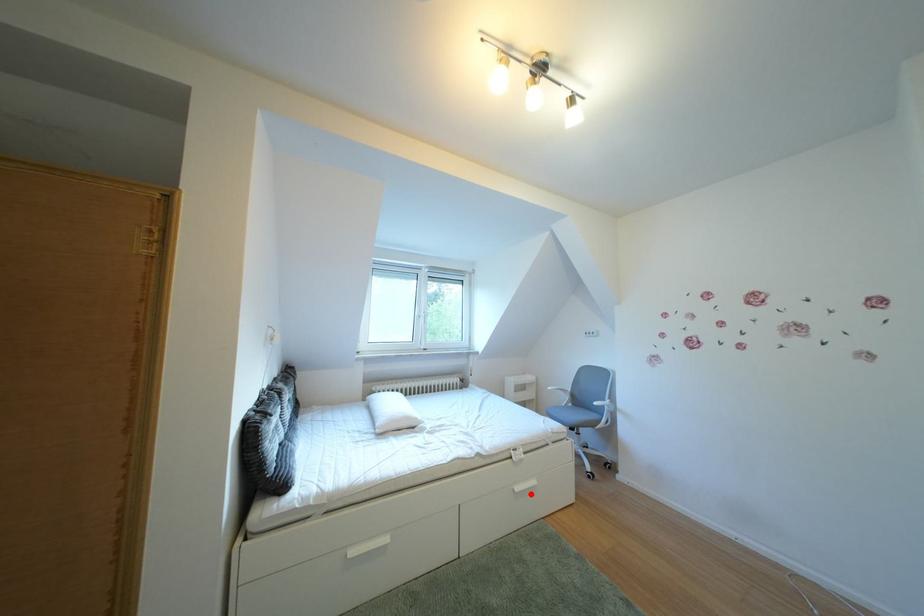
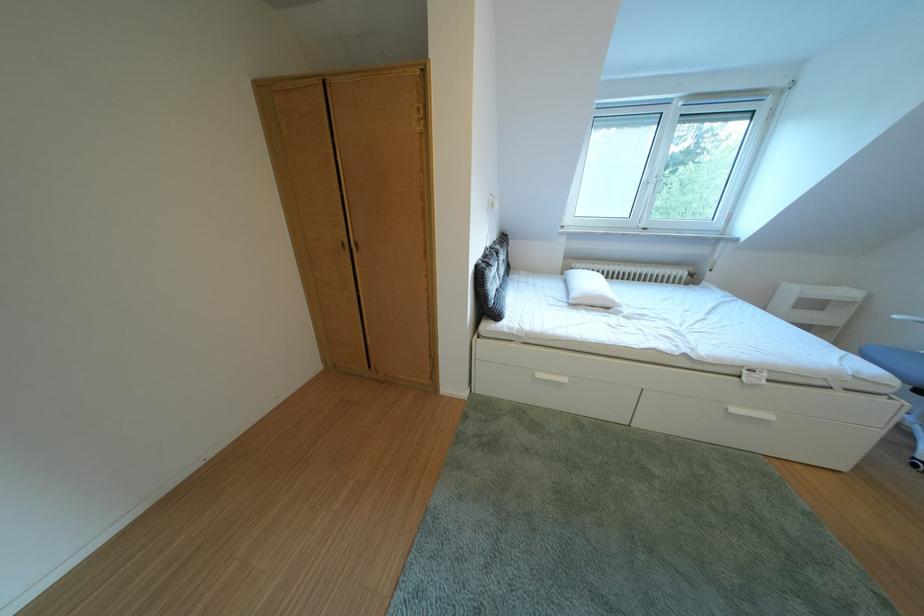
Question: I am providing you with two images of the same scene from different viewpoints. A red point is shown in image1. For the corresponding object point in image2, is it positioned nearer or farther from the camera?

Choices:
 (A) Nearer
 (B) Farther

Answer: (A)